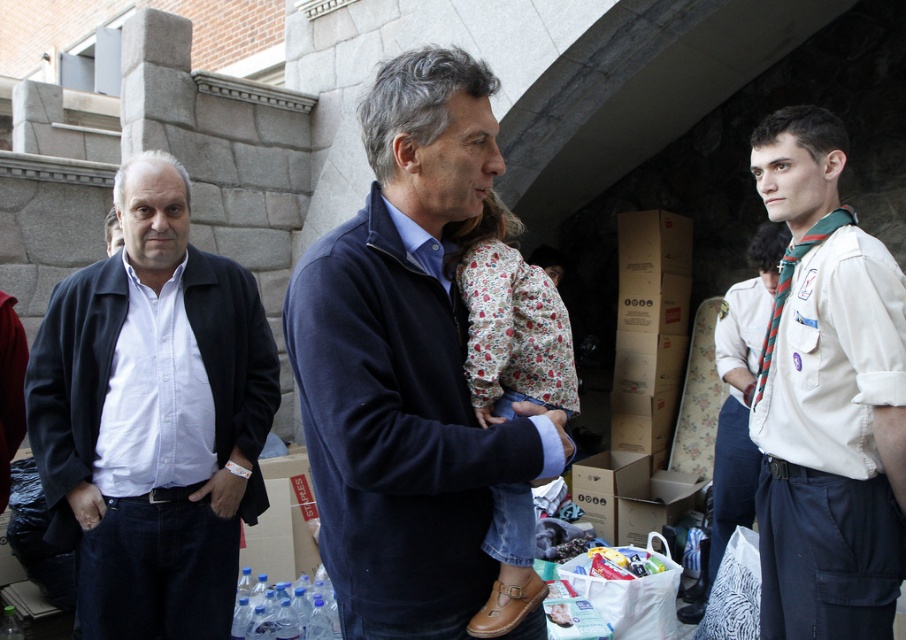
Question: Estimate the real-world distances between objects in this image. Which object is closer to the white cotton shirt at center?

Choices:
 (A) white matte shirt at left
 (B) dark blue sweater at center
 (C) white cotton shirt at right

Answer: (C)

Question: Is dark blue sweater at center to the left of white cotton shirt at right from the viewer's perspective?

Choices:
 (A) no
 (B) yes

Answer: (B)

Question: Which point is closer to the camera?

Choices:
 (A) (188, 259)
 (B) (334, 550)
 (C) (778, 344)
 (D) (721, 461)

Answer: (B)

Question: Where is dark blue sweater at center located in relation to white matte shirt at left in the image?

Choices:
 (A) below
 (B) above

Answer: (B)

Question: Which object appears closest to the camera in this image?

Choices:
 (A) white cotton shirt at center
 (B) white cotton shirt at right
 (C) dark blue sweater at center

Answer: (C)

Question: Is dark blue sweater at center below white matte shirt at left?

Choices:
 (A) yes
 (B) no

Answer: (B)